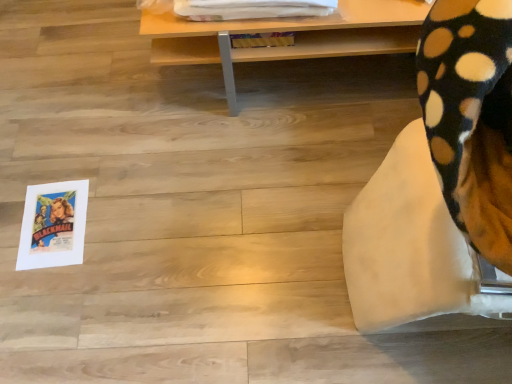
The image size is (512, 384). Find the location of `vacant area that lies in front of wooden table at upper center`. vacant area that lies in front of wooden table at upper center is located at coordinates (255, 198).